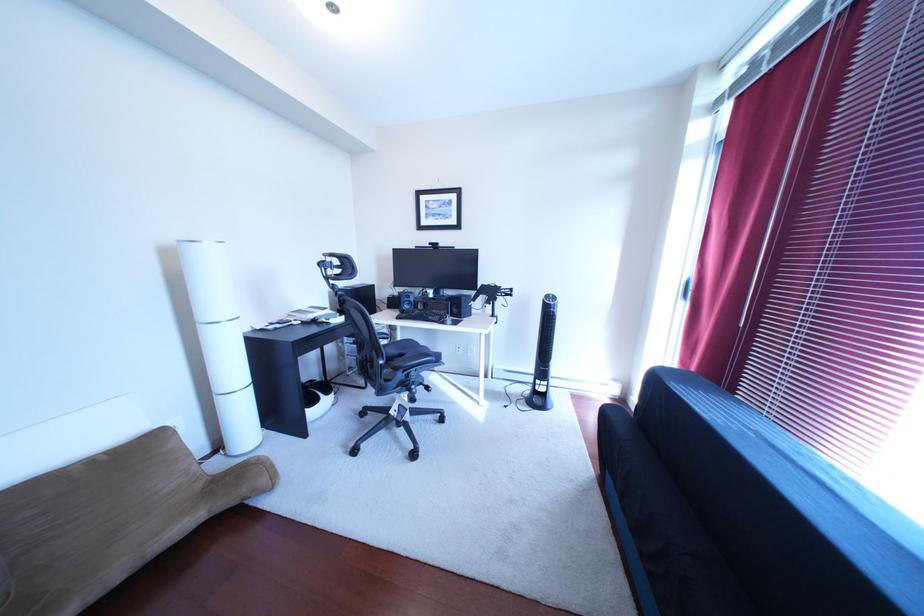
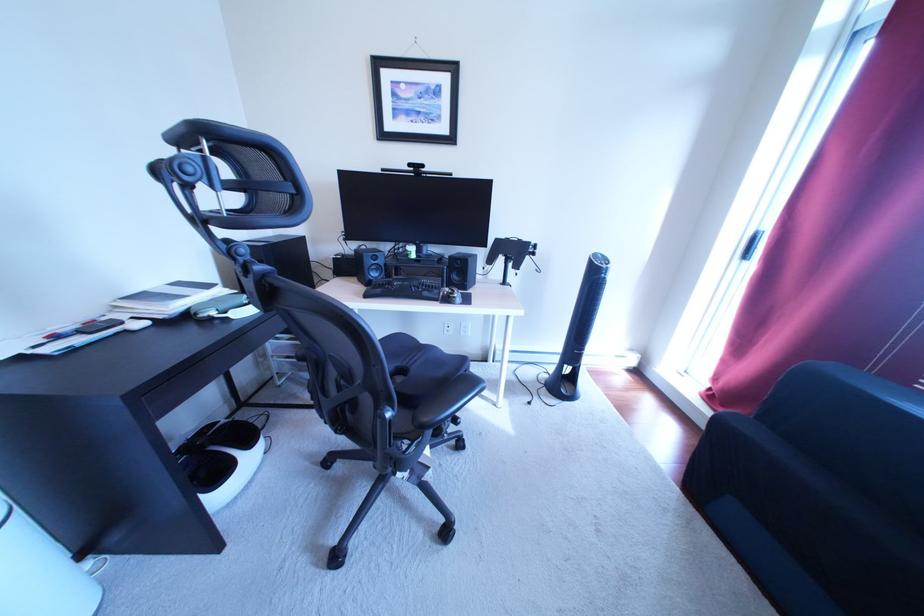
What movement of the cameraman would produce the second image?

The movement direction of the cameraman is left, forward.